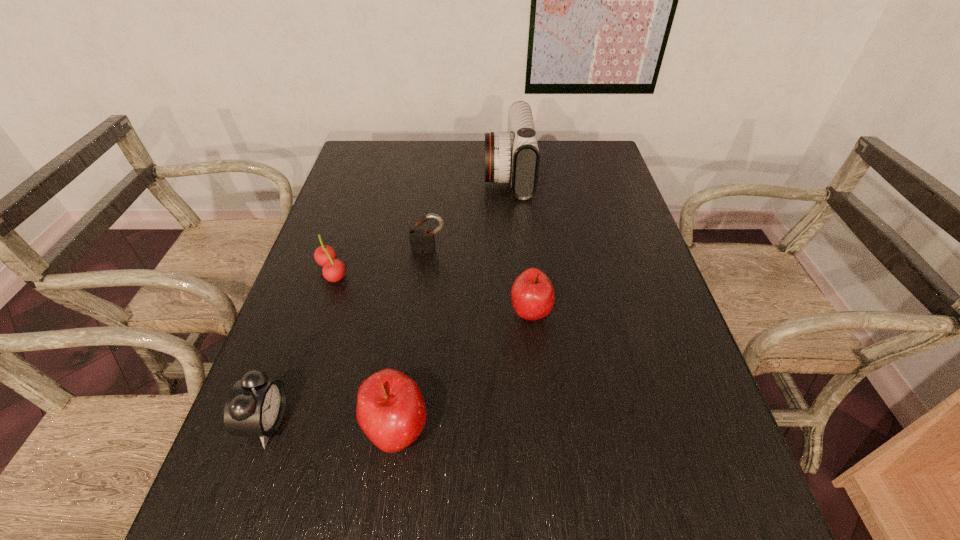
Where is `object that ranks as the closest to the farthest object`? The width and height of the screenshot is (960, 540). object that ranks as the closest to the farthest object is located at coordinates pyautogui.click(x=422, y=241).

Select which object is the closest to the alarm clock. Please provide its 2D coordinates. Your answer should be formatted as a tuple, i.e. [(x, y)], where the tuple contains the x and y coordinates of a point satisfying the conditions above.

[(390, 410)]

Identify the location of free location that satisfies the following two spatial constraints: 1. on the surface of the camcorder; 2. on the front side of the cherry. (516, 272).

Locate an element on the screen. free spot that satisfies the following two spatial constraints: 1. on the surface of the fourth farthest object; 2. on the left side of the camcorder is located at coordinates click(x=519, y=312).

Locate an element on the screen. Image resolution: width=960 pixels, height=540 pixels. vacant space that satisfies the following two spatial constraints: 1. with the keyhole on the front of the fifth nearest object; 2. on the front side of the alarm clock is located at coordinates (408, 422).

Image resolution: width=960 pixels, height=540 pixels. In order to click on free space that satisfies the following two spatial constraints: 1. on the front side of the shortest object; 2. on the front side of the alarm clock in this screenshot , I will do `click(281, 422)`.

You are a GUI agent. You are given a task and a screenshot of the screen. Output one action in this format:
    pyautogui.click(x=<x>, y=<y>)
    Task: Click on the free space in the image that satisfies the following two spatial constraints: 1. on the front side of the left apple; 2. on the left side of the alarm clock
    Image resolution: width=960 pixels, height=540 pixels.
    Given the screenshot: What is the action you would take?
    pyautogui.click(x=264, y=431)

In order to click on vacant position in the image that satisfies the following two spatial constraints: 1. on the surface of the camcorder; 2. with the keyhole on the front of the second farthest object in this screenshot , I will do `click(515, 250)`.